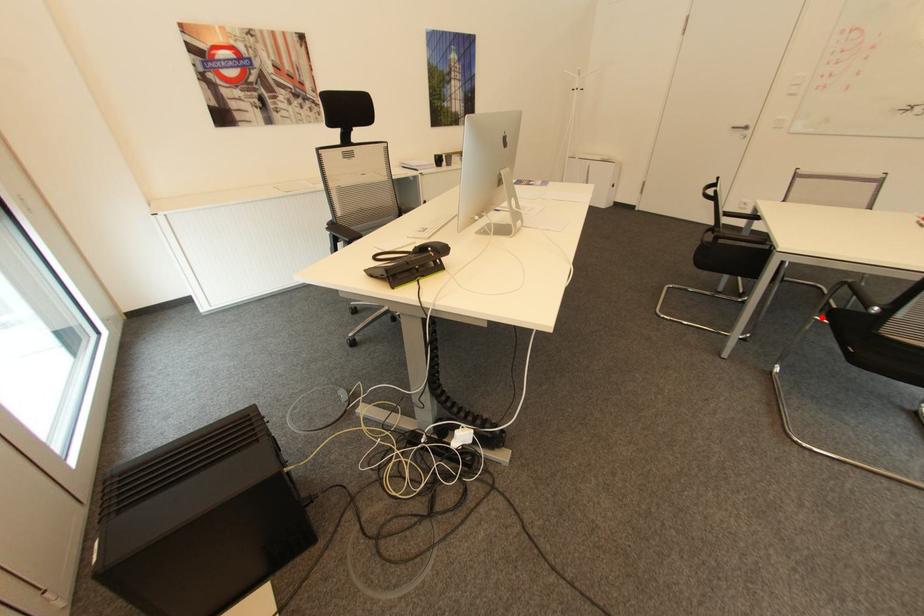
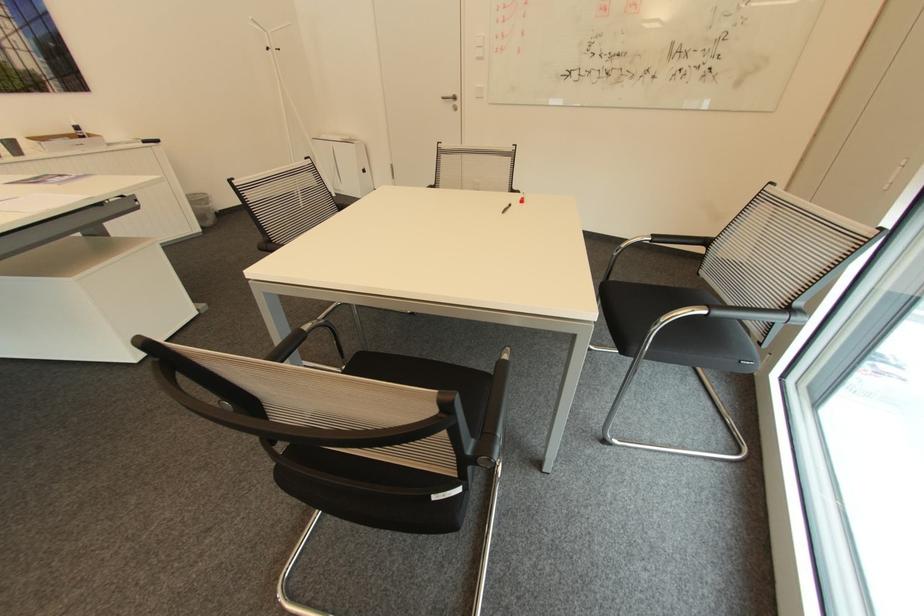
Where in the second image is the point corresponding to the highlighted location from the first image?

(347, 368)